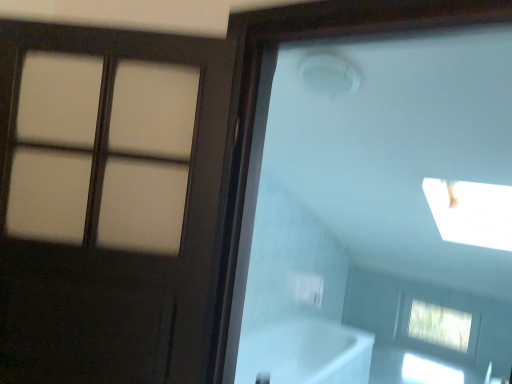
Image resolution: width=512 pixels, height=384 pixels. I want to click on matte brown door at left, so click(113, 250).

What do you see at coordinates (113, 250) in the screenshot? I see `matte brown door at left` at bounding box center [113, 250].

Locate an element on the screen. matte brown door at left is located at coordinates (113, 250).

In the image, is clear glass window at lower right positioned in front of or behind white glossy bathtub at lower center?

clear glass window at lower right is positioned farther from the viewer than white glossy bathtub at lower center.

What's the angular difference between clear glass window at lower right and white glossy bathtub at lower center's facing directions?

88.8 degrees.

Is clear glass window at lower right wider than white glossy bathtub at lower center?

In fact, clear glass window at lower right might be narrower than white glossy bathtub at lower center.

Considering the sizes of objects clear glass window at lower right and white glossy bathtub at lower center in the image provided, who is taller, clear glass window at lower right or white glossy bathtub at lower center?

white glossy bathtub at lower center.

From the image's perspective, which one is positioned higher, white glossy bathtub at lower center or matte brown door at left?

matte brown door at left.

Is white glossy bathtub at lower center shorter than matte brown door at left?

Yes.

How many degrees apart are the facing directions of white glossy bathtub at lower center and matte brown door at left?

56 degrees.

How much distance is there between white glossy bathtub at lower center and matte brown door at left?

white glossy bathtub at lower center is 2.15 meters from matte brown door at left.

Is white glossy bathtub at lower center positioned far away from clear glass window at lower right?

white glossy bathtub at lower center is positioned a significant distance from clear glass window at lower right.

Could you tell me if white glossy bathtub at lower center is turned towards clear glass window at lower right?

No.

Where is `bath that is on the left side of clear glass window at lower right`? The width and height of the screenshot is (512, 384). bath that is on the left side of clear glass window at lower right is located at coordinates (305, 353).

Considering the relative positions of matte brown door at left and clear glass window at lower right in the image provided, is matte brown door at left in front of clear glass window at lower right?

Yes.

Does point (5, 372) lie behind point (425, 305)?

No, it is in front of (425, 305).

Locate an element on the screen. The width and height of the screenshot is (512, 384). door on the left side of clear glass window at lower right is located at coordinates tap(113, 250).

Between matte brown door at left and white glossy bathtub at lower center, which one has smaller size?

matte brown door at left is smaller.

Is matte brown door at left to the left or to the right of white glossy bathtub at lower center in the image?

matte brown door at left is to the left of white glossy bathtub at lower center.

Is matte brown door at left behind white glossy bathtub at lower center?

That is False.

Looking at this image, could you tell me if matte brown door at left is facing white glossy bathtub at lower center?

No.

Would you say matte brown door at left is part of clear glass window at lower right's contents?

No, matte brown door at left is not inside clear glass window at lower right.

From a real-world perspective, is clear glass window at lower right positioned above or below matte brown door at left?

clear glass window at lower right is below matte brown door at left.

From the image's perspective, which one is positioned higher, clear glass window at lower right or matte brown door at left?

matte brown door at left is shown above in the image.

Locate an element on the screen. The height and width of the screenshot is (384, 512). bath that appears below the clear glass window at lower right (from a real-world perspective) is located at coordinates (305, 353).

In the image, there is a matte brown door at left. Where is `bath below it (from the image's perspective)`? bath below it (from the image's perspective) is located at coordinates (305, 353).

When comparing their distances from white glossy bathtub at lower center, does clear glass window at lower right or matte brown door at left seem closer?

clear glass window at lower right lies closer to white glossy bathtub at lower center than the other object.

From the image, which object appears to be nearer to white glossy bathtub at lower center, matte brown door at left or clear glass window at lower right?

Based on the image, clear glass window at lower right appears to be nearer to white glossy bathtub at lower center.

From the image, which object appears to be nearer to matte brown door at left, clear glass window at lower right or white glossy bathtub at lower center?

white glossy bathtub at lower center lies closer to matte brown door at left than the other object.

When comparing their distances from clear glass window at lower right, does white glossy bathtub at lower center or matte brown door at left seem closer?

white glossy bathtub at lower center is closer to clear glass window at lower right.

Based on their spatial positions, is white glossy bathtub at lower center or clear glass window at lower right further from matte brown door at left?

clear glass window at lower right.

Based on their spatial positions, is matte brown door at left or white glossy bathtub at lower center closer to clear glass window at lower right?

Among the two, white glossy bathtub at lower center is located nearer to clear glass window at lower right.

Locate an element on the screen. This screenshot has height=384, width=512. bath between matte brown door at left and clear glass window at lower right in the front-back direction is located at coordinates (305, 353).